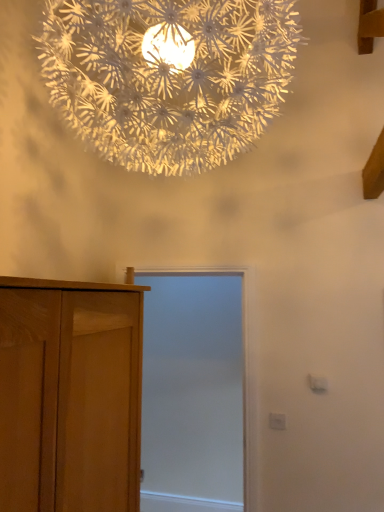
Question: Considering the relative sizes of light brown wooden cupboard at left and white matte screen door at center in the image provided, is light brown wooden cupboard at left smaller than white matte screen door at center?

Choices:
 (A) no
 (B) yes

Answer: (A)

Question: Can you confirm if light brown wooden cupboard at left is thinner than white matte screen door at center?

Choices:
 (A) yes
 (B) no

Answer: (B)

Question: Can you confirm if light brown wooden cupboard at left is taller than white matte screen door at center?

Choices:
 (A) yes
 (B) no

Answer: (B)

Question: Is light brown wooden cupboard at left to the right of white matte screen door at center from the viewer's perspective?

Choices:
 (A) no
 (B) yes

Answer: (A)

Question: Considering the relative positions of light brown wooden cupboard at left and white matte screen door at center in the image provided, is light brown wooden cupboard at left to the left of white matte screen door at center from the viewer's perspective?

Choices:
 (A) no
 (B) yes

Answer: (B)

Question: Considering the positions of point (150, 328) and point (59, 293), is point (150, 328) closer or farther from the camera than point (59, 293)?

Choices:
 (A) closer
 (B) farther

Answer: (B)

Question: Would you say white matte screen door at center is inside or outside light brown wooden cupboard at left?

Choices:
 (A) inside
 (B) outside

Answer: (B)

Question: From a real-world perspective, is white matte screen door at center physically located above or below light brown wooden cupboard at left?

Choices:
 (A) above
 (B) below

Answer: (B)

Question: Is white matte screen door at center wider or thinner than light brown wooden cupboard at left?

Choices:
 (A) thin
 (B) wide

Answer: (A)

Question: Looking at their shapes, would you say light brown wooden cupboard at left is wider or thinner than white matte screen door at center?

Choices:
 (A) wide
 (B) thin

Answer: (A)

Question: Is light brown wooden cupboard at left taller or shorter than white matte screen door at center?

Choices:
 (A) tall
 (B) short

Answer: (B)

Question: From the image's perspective, is light brown wooden cupboard at left positioned above or below white matte screen door at center?

Choices:
 (A) above
 (B) below

Answer: (A)

Question: Considering their positions, is light brown wooden cupboard at left located in front of or behind white matte screen door at center?

Choices:
 (A) front
 (B) behind

Answer: (A)

Question: In terms of height, does white paper-like at upper center look taller or shorter compared to light brown wooden cupboard at left?

Choices:
 (A) short
 (B) tall

Answer: (B)

Question: Visually, is white paper-like at upper center positioned to the left or to the right of light brown wooden cupboard at left?

Choices:
 (A) left
 (B) right

Answer: (B)